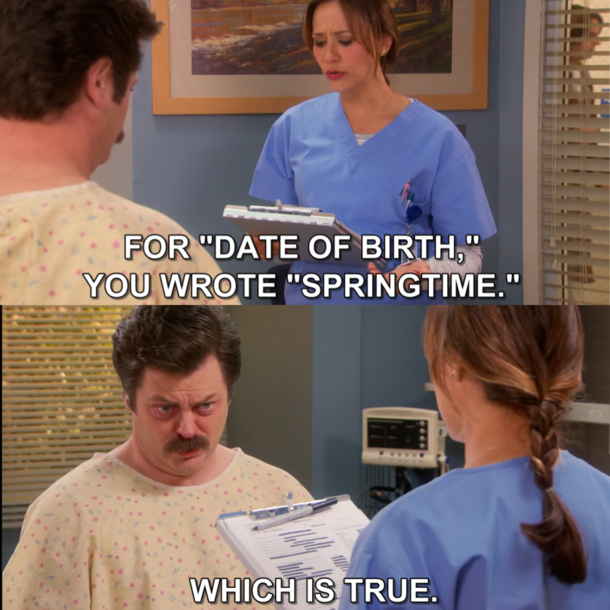
I want to click on window blinds, so click(592, 162), click(55, 400).